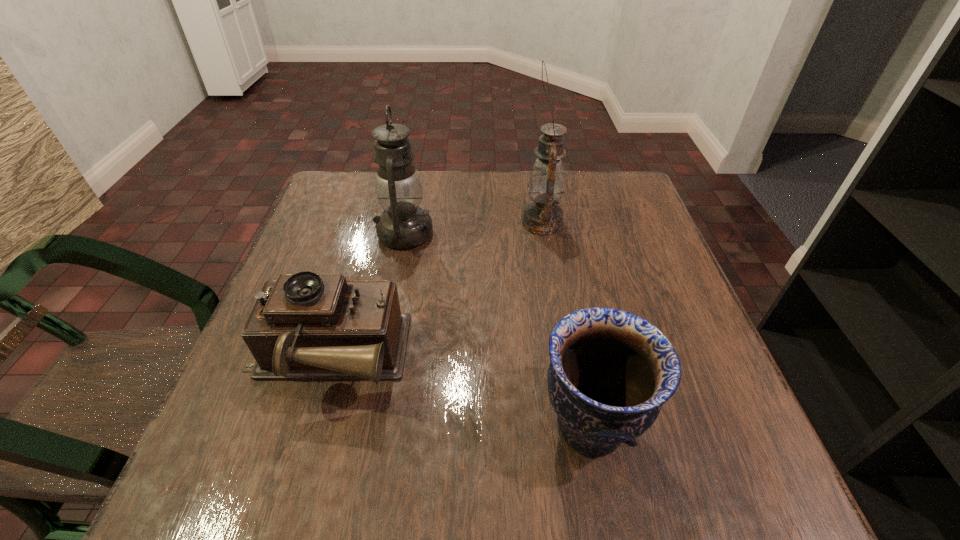
Identify the location of vacant space located on the front handle of the pottery. This screenshot has height=540, width=960. (291, 426).

The height and width of the screenshot is (540, 960). Find the location of `vacant region located on the horn of the phonograph_record`. vacant region located on the horn of the phonograph_record is located at coordinates (616, 358).

This screenshot has height=540, width=960. In order to click on object that is at the near edge in this screenshot , I will do `click(610, 372)`.

Identify the location of object present at the left edge. (306, 326).

The height and width of the screenshot is (540, 960). I want to click on object situated at the right edge, so click(x=610, y=372).

At what (x,y) coordinates should I click in order to perform the action: click on object located at the near right corner. Please return your answer as a coordinate pair (x, y). Looking at the image, I should click on (610, 372).

Locate an element on the screen. Image resolution: width=960 pixels, height=540 pixels. blank space at the far edge of the desktop is located at coordinates (422, 197).

In the image, there is a desktop. Identify the location of vacant area at the left edge. (328, 226).

The height and width of the screenshot is (540, 960). Identify the location of vacant space at the right edge. (659, 282).

The height and width of the screenshot is (540, 960). In the image, there is a desktop. What are the coordinates of `blank space at the far left corner` in the screenshot? It's located at (354, 191).